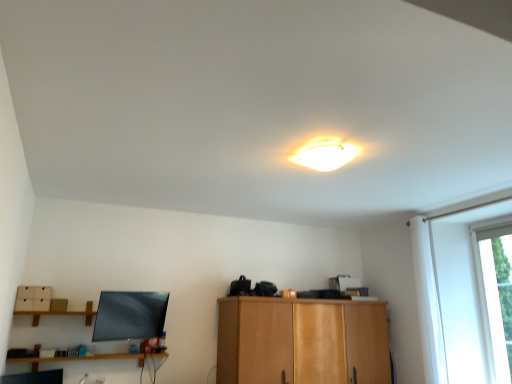
Question: Is white glossy ceiling light at upper center smaller than wooden shelf at lower left?

Choices:
 (A) yes
 (B) no

Answer: (A)

Question: Is white glossy ceiling light at upper center oriented towards wooden shelf at lower left?

Choices:
 (A) no
 (B) yes

Answer: (A)

Question: From a real-world perspective, is white glossy ceiling light at upper center located beneath wooden shelf at lower left?

Choices:
 (A) no
 (B) yes

Answer: (A)

Question: Is the position of white glossy ceiling light at upper center more distant than that of wooden shelf at lower left?

Choices:
 (A) no
 (B) yes

Answer: (A)

Question: Considering the relative sizes of white glossy ceiling light at upper center and wooden shelf at lower left in the image provided, is white glossy ceiling light at upper center taller than wooden shelf at lower left?

Choices:
 (A) yes
 (B) no

Answer: (B)

Question: Is point (292, 311) positioned closer to the camera than point (353, 145)?

Choices:
 (A) farther
 (B) closer

Answer: (A)

Question: Considering the positions of wooden cabinet at center and white glossy ceiling light at upper center in the image, is wooden cabinet at center wider or thinner than white glossy ceiling light at upper center?

Choices:
 (A) thin
 (B) wide

Answer: (B)

Question: Is wooden cabinet at center in front of or behind white glossy ceiling light at upper center in the image?

Choices:
 (A) front
 (B) behind

Answer: (B)

Question: Based on their positions, is wooden cabinet at center located to the left or right of white glossy ceiling light at upper center?

Choices:
 (A) left
 (B) right

Answer: (B)

Question: From the image's perspective, is transparent glass window at right positioned above or below wooden shelf at lower left?

Choices:
 (A) below
 (B) above

Answer: (B)

Question: From a real-world perspective, relative to wooden shelf at lower left, is transparent glass window at right vertically above or below?

Choices:
 (A) above
 (B) below

Answer: (A)

Question: In terms of height, does transparent glass window at right look taller or shorter compared to wooden shelf at lower left?

Choices:
 (A) tall
 (B) short

Answer: (A)

Question: Relative to wooden shelf at lower left, is transparent glass window at right in front or behind?

Choices:
 (A) front
 (B) behind

Answer: (B)

Question: Is point (501, 307) closer or farther from the camera than point (236, 370)?

Choices:
 (A) closer
 (B) farther

Answer: (B)

Question: Is transparent glass window at right to the left or to the right of wooden cabinet at center in the image?

Choices:
 (A) left
 (B) right

Answer: (B)